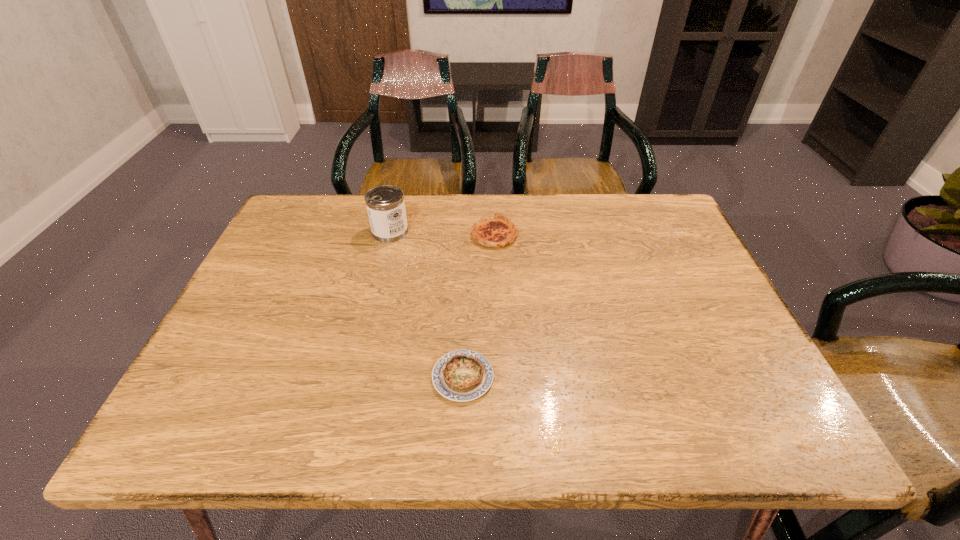
Identify the location of can. (385, 204).

The height and width of the screenshot is (540, 960). What are the coordinates of `the leftmost object` in the screenshot? It's located at click(x=385, y=204).

At what (x,y) coordinates should I click in order to perform the action: click on the second tallest object. Please return your answer as a coordinate pair (x, y). This screenshot has height=540, width=960. Looking at the image, I should click on (498, 231).

The width and height of the screenshot is (960, 540). I want to click on the taller quiche, so click(498, 231).

At what (x,y) coordinates should I click in order to perform the action: click on the shortest object. Please return your answer as a coordinate pair (x, y). This screenshot has width=960, height=540. Looking at the image, I should click on (462, 375).

I want to click on the nearer quiche, so click(x=462, y=375).

This screenshot has height=540, width=960. I want to click on vacant space located 0.110m on the front of the can, so click(381, 269).

You are a GUI agent. You are given a task and a screenshot of the screen. Output one action in this format:
    pyautogui.click(x=<x>, y=<y>)
    Task: Click on the free region located 0.220m on the front of the farther quiche
    This screenshot has width=960, height=540.
    Given the screenshot: What is the action you would take?
    pyautogui.click(x=497, y=309)

Image resolution: width=960 pixels, height=540 pixels. I want to click on free space located 0.370m on the left of the shortest object, so click(252, 377).

You are a GUI agent. You are given a task and a screenshot of the screen. Output one action in this format:
    pyautogui.click(x=<x>, y=<y>)
    Task: Click on the can that is positioned at the far edge
    
    Given the screenshot: What is the action you would take?
    click(385, 204)